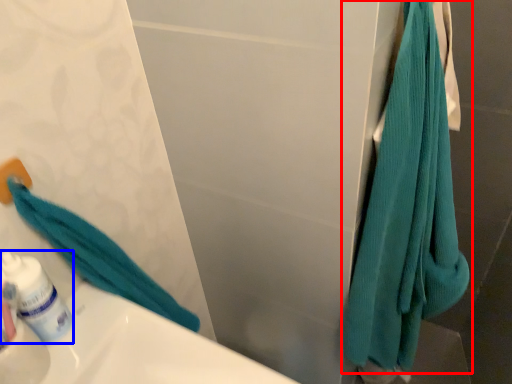
Question: Among these objects, which one is farthest to the camera, towel (highlighted by a red box) or mouthwash (highlighted by a blue box)?

Choices:
 (A) towel
 (B) mouthwash

Answer: (B)